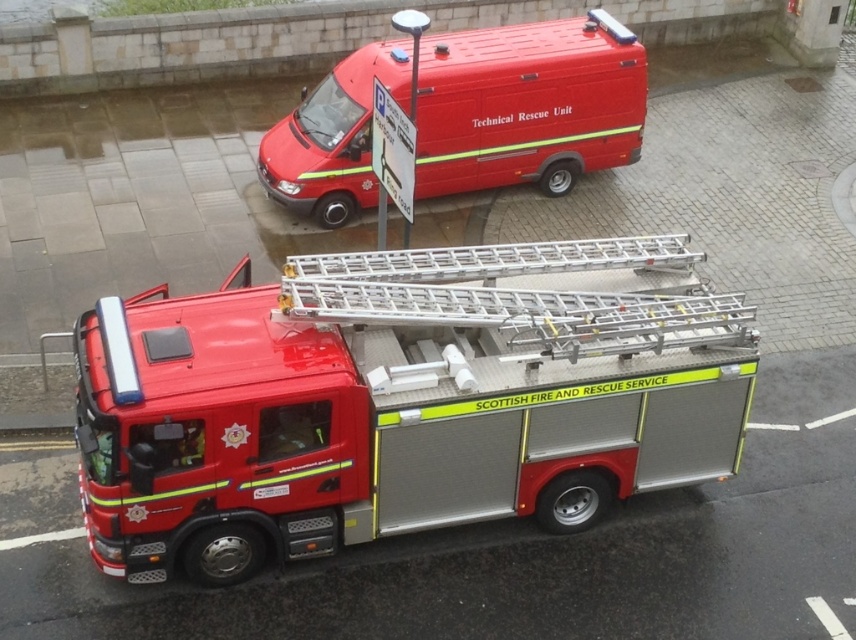
Looking at this image, is metallic red van at upper center further to camera compared to silver/aluminum ladder at center?

Yes, metallic red van at upper center is further from the viewer.

Between metallic red van at upper center and silver/aluminum ladder at center, which one appears on the left side from the viewer's perspective?

From the viewer's perspective, silver/aluminum ladder at center appears more on the left side.

Find the location of a particular element. Image resolution: width=856 pixels, height=640 pixels. metallic red van at upper center is located at coordinates (528, 104).

Does metallic silver fire truck at center have a greater width compared to silver/aluminum ladder at center?

No, metallic silver fire truck at center is not wider than silver/aluminum ladder at center.

Is point (120, 420) in front of point (631, 296)?

Yes.

Between point (187, 394) and point (580, 304), which one is positioned in front?

Point (187, 394)

Where is `metallic silver fire truck at center`? The height and width of the screenshot is (640, 856). metallic silver fire truck at center is located at coordinates (399, 401).

Does metallic silver fire truck at center appear over metallic red van at upper center?

Incorrect, metallic silver fire truck at center is not positioned above metallic red van at upper center.

Between point (688, 429) and point (446, 49), which one is positioned behind?

Positioned behind is point (446, 49).

Where is `metallic silver fire truck at center`? The width and height of the screenshot is (856, 640). metallic silver fire truck at center is located at coordinates (399, 401).